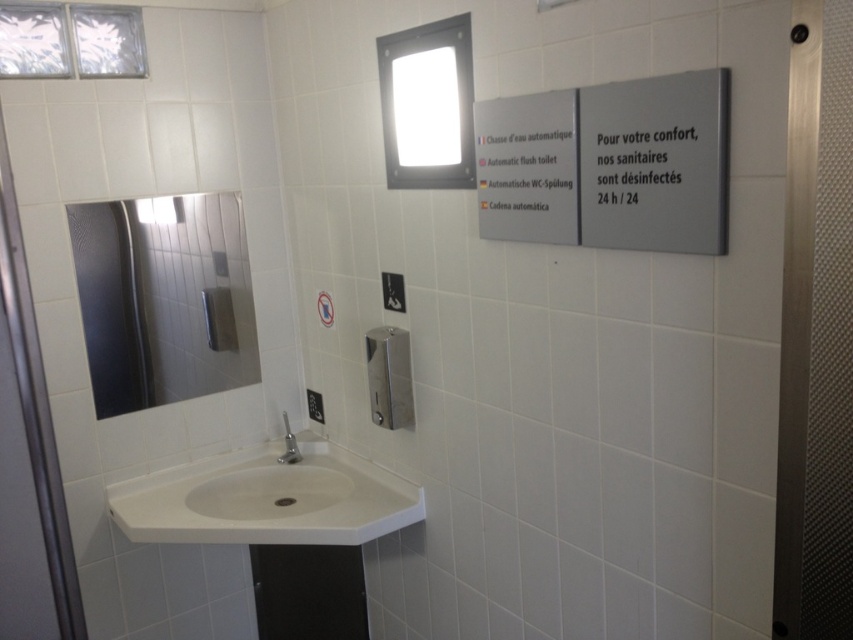
Can you confirm if silver/metallic mirror at upper left is positioned to the left of gray matte sign at upper right?

Indeed, silver/metallic mirror at upper left is positioned on the left side of gray matte sign at upper right.

Where is `silver/metallic mirror at upper left`? silver/metallic mirror at upper left is located at coordinates (163, 298).

Is point (670, 154) in front of point (572, 236)?

Yes, point (670, 154) is in front of point (572, 236).

Between gray matte sign at upper right and metallic silver sign at upper center, which one has more height?

Standing taller between the two is gray matte sign at upper right.

Does point (676, 205) come closer to viewer compared to point (485, 115)?

Yes, it is.

At what (x,y) coordinates should I click in order to perform the action: click on gray matte sign at upper right. Please return your answer as a coordinate pair (x, y). This screenshot has height=640, width=853. Looking at the image, I should click on (654, 163).

Can you confirm if metallic silver sign at upper center is thinner than satin nickel faucet at corner?

No, metallic silver sign at upper center is not thinner than satin nickel faucet at corner.

Find the location of a particular element. The height and width of the screenshot is (640, 853). metallic silver sign at upper center is located at coordinates (527, 168).